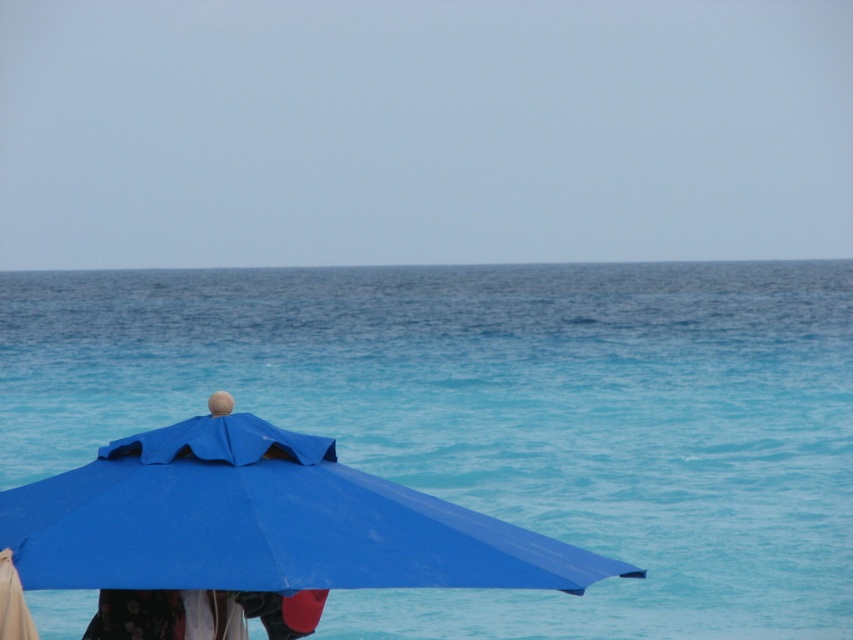
You are standing at the origin point of the beach scene. There is a blue fabric umbrella at lower left marked by point (254,532). If you want to walk directly to the umbrella, which direction should you move? Please answer with either north, south, east, or west.

The point (254,532) is located at the lower left of the scene, so to reach the blue fabric umbrella at lower left from the origin, you should move southwest.

You are standing on the beach and see two points marked on the sand. The first point is at coordinates point (405, 454) and the second is at point (84, 499). If you want to walk from the first point to the second point, which direction should you move relative to the beach umbrella?

Point (405, 454) is behind point (84, 499) relative to the beach umbrella, so you should move forward towards the ocean to reach the second point.

You are standing on the beach and see the blue water at center and the floral fabric dress at lower left. Which object is nearer to you?

The blue water at center is closer to the viewer than the floral fabric dress at lower left.